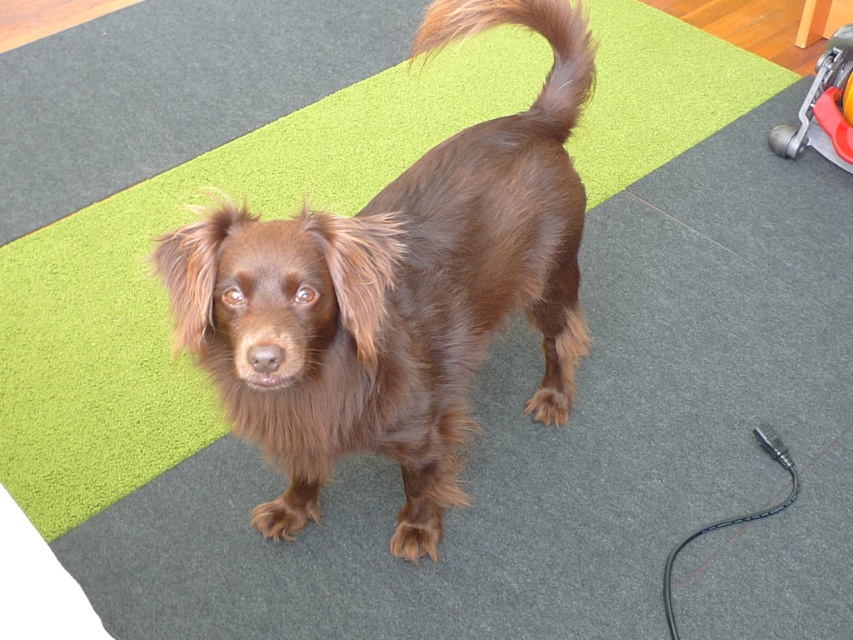
Who is positioned more to the left, orange plastic baby carriage at lower right or black rubber leash at lower right?

Positioned to the left is black rubber leash at lower right.

Could you measure the distance between orange plastic baby carriage at lower right and black rubber leash at lower right?

They are 3.97 feet apart.

Find the location of a particular element. The height and width of the screenshot is (640, 853). orange plastic baby carriage at lower right is located at coordinates (822, 108).

Find the location of a particular element. orange plastic baby carriage at lower right is located at coordinates (822, 108).

Does point (387, 422) come behind point (844, 67)?

No, it is in front of (844, 67).

Is brown furry dog at center bigger than orange plastic baby carriage at lower right?

Yes, brown furry dog at center is bigger than orange plastic baby carriage at lower right.

Is point (225, 296) less distant than point (793, 136)?

Yes, point (225, 296) is closer to viewer.

The width and height of the screenshot is (853, 640). What are the coordinates of `brown furry dog at center` in the screenshot? It's located at (397, 292).

Who is positioned more to the right, brown furry dog at center or brown furry tail at upper center?

From the viewer's perspective, brown furry tail at upper center appears more on the right side.

Is point (250, 515) positioned after point (463, 10)?

Yes, point (250, 515) is behind point (463, 10).

Where is `brown furry dog at center`? brown furry dog at center is located at coordinates (397, 292).